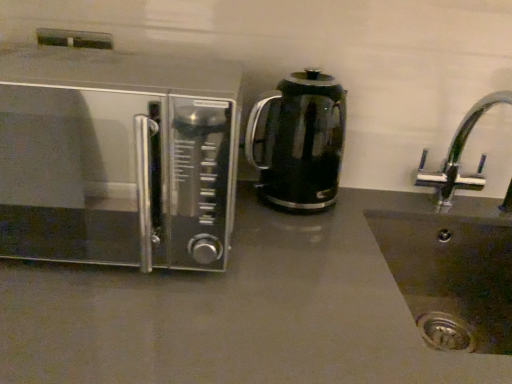
Where is `blank space situated above matte gray countertop at center (from a real-world perspective)`? This screenshot has width=512, height=384. blank space situated above matte gray countertop at center (from a real-world perspective) is located at coordinates (256, 259).